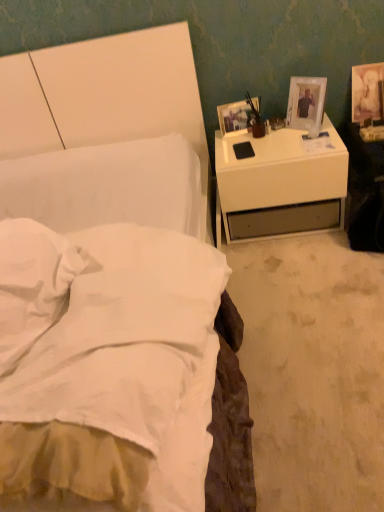
Question: Does white glossy nightstand at right have a larger size compared to matte white picture frame at upper right, the 1th picture frame positioned from the left?

Choices:
 (A) no
 (B) yes

Answer: (B)

Question: Is matte white picture frame at upper right, the third picture frame from the right, inside white glossy nightstand at right?

Choices:
 (A) yes
 (B) no

Answer: (B)

Question: Is white glossy nightstand at right touching matte white picture frame at upper right, the 1th picture frame positioned from the left?

Choices:
 (A) yes
 (B) no

Answer: (B)

Question: From the image's perspective, is white glossy nightstand at right on top of matte white picture frame at upper right, the 1th picture frame positioned from the left?

Choices:
 (A) no
 (B) yes

Answer: (A)

Question: Can you confirm if white glossy nightstand at right is thinner than matte white picture frame at upper right, the third picture frame from the right?

Choices:
 (A) yes
 (B) no

Answer: (B)

Question: Considering the relative positions of matte white picture frame at upper right, the 1th picture frame positioned from the left, and white soft pillow at lower left in the image provided, is matte white picture frame at upper right, the 1th picture frame positioned from the left, to the left or to the right of white soft pillow at lower left?

Choices:
 (A) left
 (B) right

Answer: (B)

Question: Considering their positions, is matte white picture frame at upper right, the third picture frame from the right, located in front of or behind white soft pillow at lower left?

Choices:
 (A) front
 (B) behind

Answer: (B)

Question: From the image's perspective, is matte white picture frame at upper right, the third picture frame from the right, located above or below white soft pillow at lower left?

Choices:
 (A) above
 (B) below

Answer: (A)

Question: In terms of height, does matte white picture frame at upper right, the 1th picture frame positioned from the left, look taller or shorter compared to white soft pillow at lower left?

Choices:
 (A) tall
 (B) short

Answer: (A)

Question: Considering the relative positions of white soft bed at left and white plastic picture frame at upper right, the second picture frame viewed from the left, in the image provided, is white soft bed at left to the left or to the right of white plastic picture frame at upper right, the second picture frame viewed from the left,?

Choices:
 (A) left
 (B) right

Answer: (A)

Question: Would you say white soft bed at left is inside or outside white plastic picture frame at upper right, the second picture frame viewed from the left?

Choices:
 (A) inside
 (B) outside

Answer: (B)

Question: From a real-world perspective, is white soft bed at left positioned above or below white plastic picture frame at upper right, acting as the 2th picture frame starting from the right?

Choices:
 (A) above
 (B) below

Answer: (B)

Question: From the image's perspective, is white soft bed at left located above or below white plastic picture frame at upper right, the second picture frame viewed from the left?

Choices:
 (A) above
 (B) below

Answer: (B)

Question: Considering the positions of point (369, 110) and point (309, 99), is point (369, 110) closer or farther from the camera than point (309, 99)?

Choices:
 (A) farther
 (B) closer

Answer: (A)

Question: Is matte gold picture frame at upper right, arranged as the third picture frame when viewed from the left, inside the boundaries of white plastic picture frame at upper right, acting as the 2th picture frame starting from the right, or outside?

Choices:
 (A) outside
 (B) inside

Answer: (A)